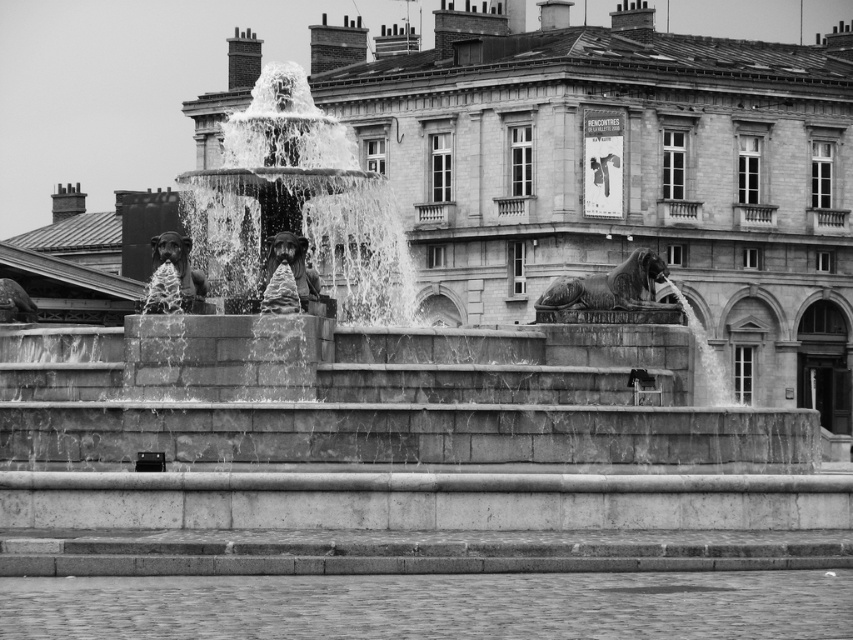
You are standing in front of the fountain and want to take a photo that includes both the point at coordinates point [541,298] and point [289,260]. Which point is closer to the camera so you can adjust your framing accordingly?

Point [541,298] is closer to the viewer than point [289,260], so you should ensure your framing captures both points while accounting for their depth differences.

You are standing in front of the fountain and want to determine which of the two points, point (177, 259) or point (274, 236), is closer to you. Based on the scene, which point is nearer?

Point (177, 259) is closer to you as it is further to the viewer than point (274, 236).